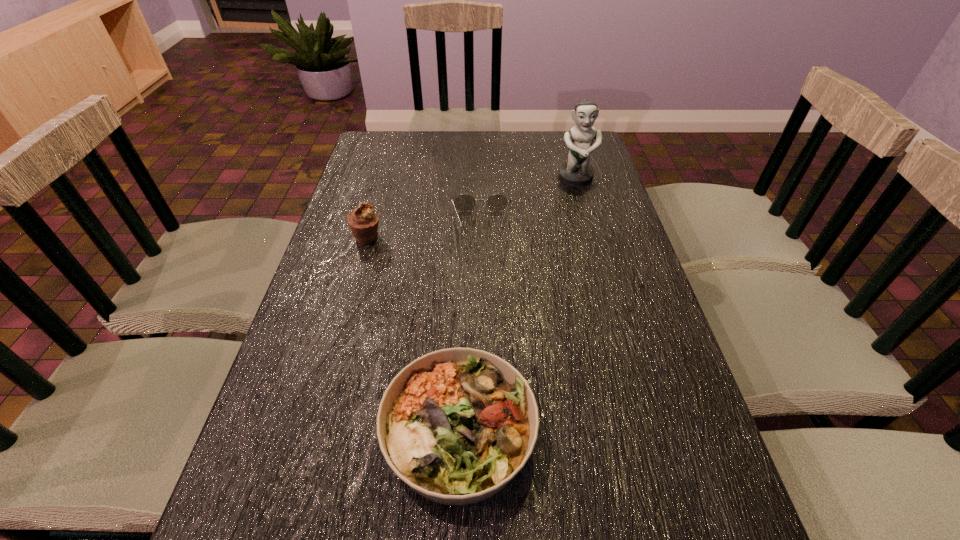
The height and width of the screenshot is (540, 960). What are the coordinates of `vacant space that's between the nearest object and the second tallest object` in the screenshot? It's located at (414, 335).

At what (x,y) coordinates should I click in order to perform the action: click on vacant point located between the shortest object and the leftmost object. Please return your answer as a coordinate pair (x, y). The width and height of the screenshot is (960, 540). Looking at the image, I should click on (424, 230).

This screenshot has height=540, width=960. Find the location of `empty location between the farthest object and the nearest object`. empty location between the farthest object and the nearest object is located at coordinates click(x=517, y=306).

Where is `vacant space that is in between the second shortest object and the spectacles`? The height and width of the screenshot is (540, 960). vacant space that is in between the second shortest object and the spectacles is located at coordinates (470, 328).

The height and width of the screenshot is (540, 960). What are the coordinates of `empty space between the nearest object and the third shortest object` in the screenshot? It's located at tap(414, 335).

The image size is (960, 540). I want to click on free spot between the muffin and the nearest object, so click(x=414, y=335).

This screenshot has height=540, width=960. I want to click on object that is the second nearest to the rightmost object, so click(x=363, y=221).

Identify which object is the second closest to the leftmost object. Please provide its 2D coordinates. Your answer should be formatted as a tuple, i.e. [(x, y)], where the tuple contains the x and y coordinates of a point satisfying the conditions above.

[(457, 424)]